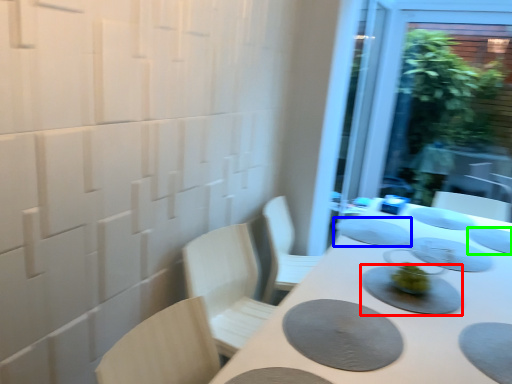
Question: Considering the real-world distances, which object is closest to tableware (highlighted by a red box)? tableware (highlighted by a blue box) or tableware (highlighted by a green box).

Choices:
 (A) tableware
 (B) tableware

Answer: (A)